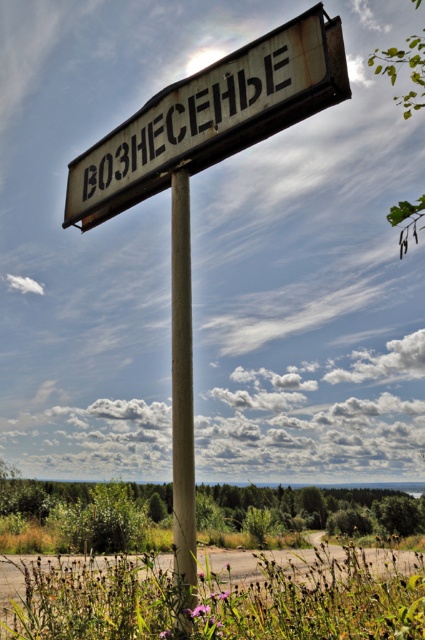
You are a hiker who just arrived at the signpost. You want to take a photo of the rusty metal pole at center with the landscape in the background. Is the rusty metal sign at upper center blocking your view of the pole?

The rusty metal pole at center is behind the rusty metal sign at upper center, so the sign is blocking the view of the pole.

You are a hiker trying to read the signpost. From your position, which object is positioned to the left of the other between the rusty metal sign at upper center and the rusty metal pole at center?

The rusty metal sign at upper center is to the left of the rusty metal pole at center.